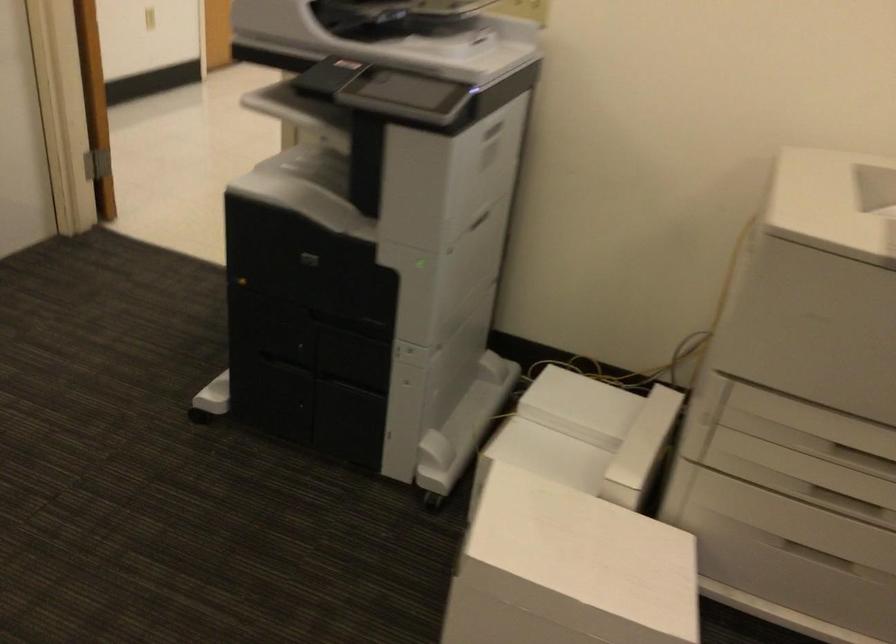
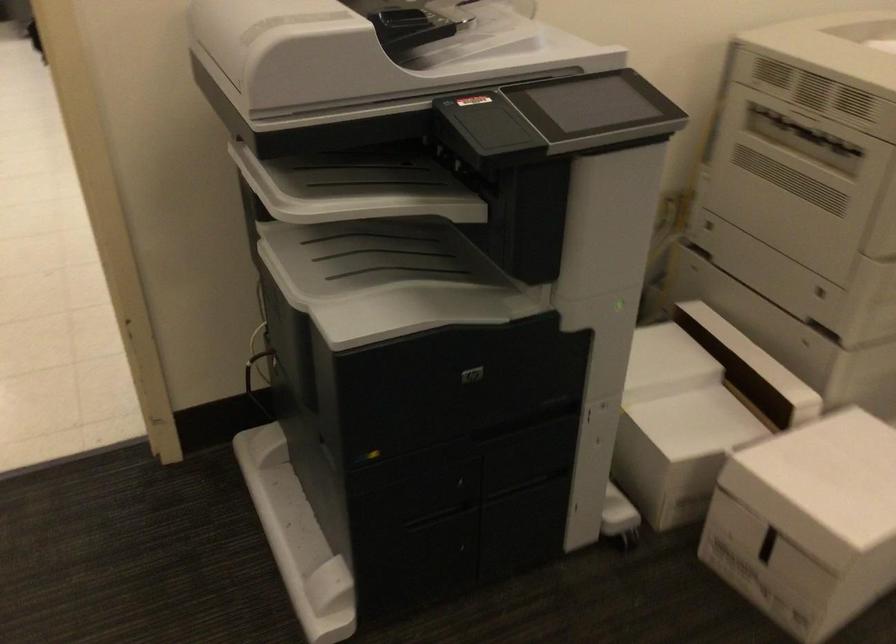
Find the pixel in the second image that matches (324,167) in the first image.

(375, 258)